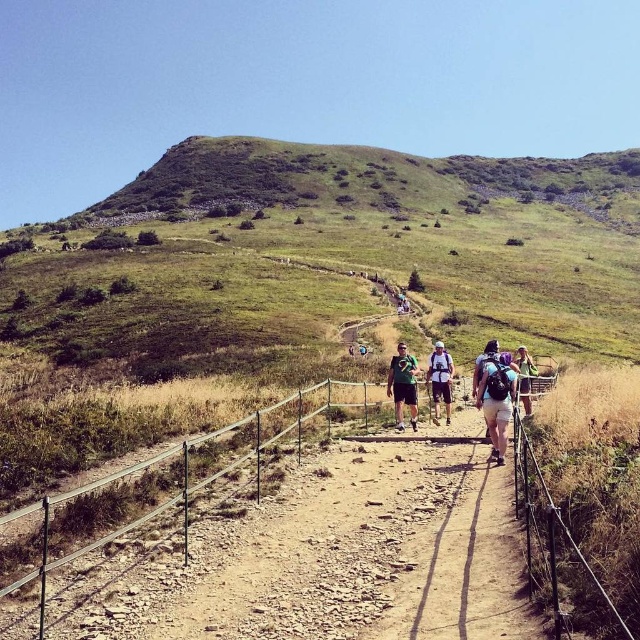
Question: Among these objects, which one is nearest to the camera?

Choices:
 (A) green fabric shirt at center
 (B) white fabric backpack at center
 (C) light blue fabric backpack at center-right

Answer: (C)

Question: Considering the real-world distances, which object is closest to the matte purple backpack at center?

Choices:
 (A) green fabric shirt at center
 (B) white fabric backpack at center
 (C) light blue fabric backpack at center-right

Answer: (A)

Question: Which point appears closest to the camera in this image?

Choices:
 (A) (506, 400)
 (B) (432, 392)
 (C) (532, 368)

Answer: (A)

Question: Is green fabric shirt at center bigger than light blue fabric backpack at center-right?

Choices:
 (A) yes
 (B) no

Answer: (B)

Question: Can you confirm if matte purple backpack at center is positioned to the right of light blue fabric backpack at center-right?

Choices:
 (A) yes
 (B) no

Answer: (B)

Question: Observing the image, what is the correct spatial positioning of matte purple backpack at center in reference to green fabric shirt at center?

Choices:
 (A) below
 (B) above

Answer: (B)